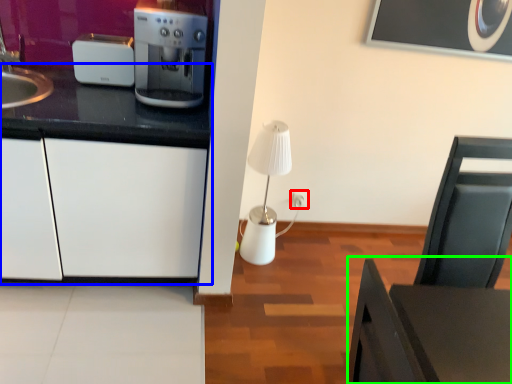
Question: Which object is the farthest from electric outlet (highlighted by a red box)? Choose among these: cabinetry (highlighted by a blue box) or table (highlighted by a green box).

Choices:
 (A) cabinetry
 (B) table

Answer: (B)